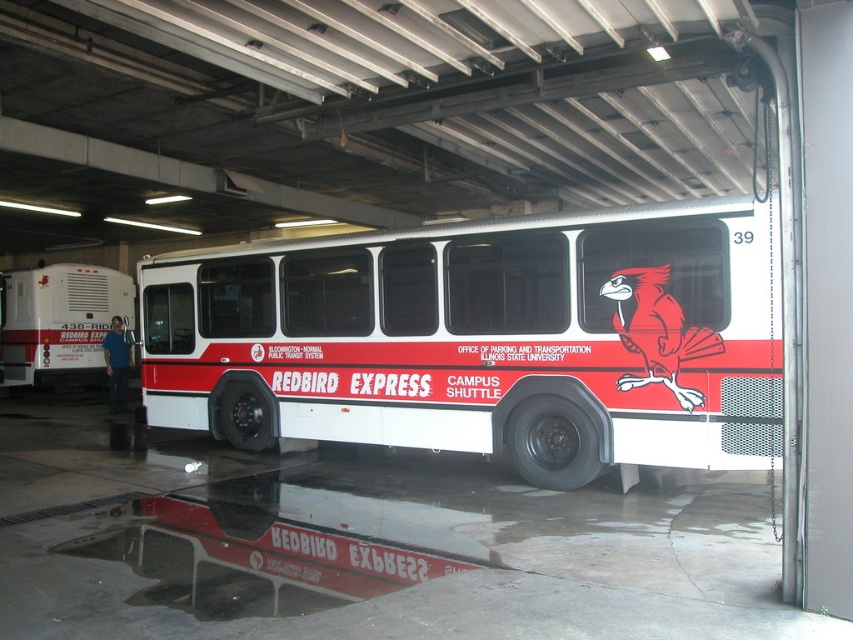
Question: Which object is closer to the camera taking this photo?

Choices:
 (A) white matte bus at center
 (B) white matte trailer at left

Answer: (A)

Question: Is white matte bus at center smaller than white matte trailer at left?

Choices:
 (A) no
 (B) yes

Answer: (B)

Question: Does white matte bus at center come in front of white matte trailer at left?

Choices:
 (A) yes
 (B) no

Answer: (A)

Question: Among these objects, which one is farthest from the camera?

Choices:
 (A) white matte bus at center
 (B) white matte trailer at left

Answer: (B)

Question: Can you confirm if white matte bus at center is thinner than white matte trailer at left?

Choices:
 (A) no
 (B) yes

Answer: (B)